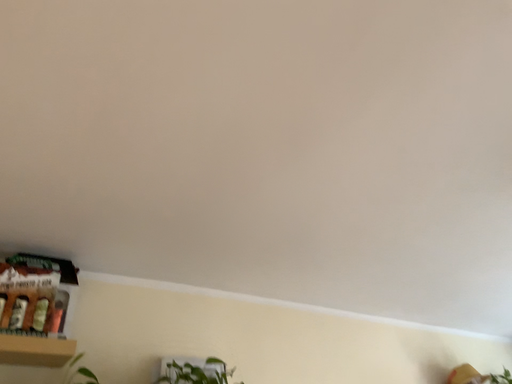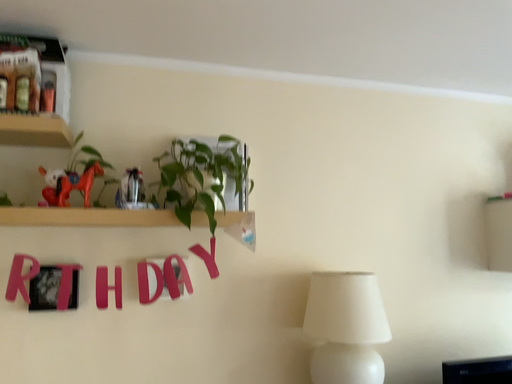
Question: How did the camera likely rotate when shooting the video?

Choices:
 (A) rotated downward
 (B) rotated upward

Answer: (A)